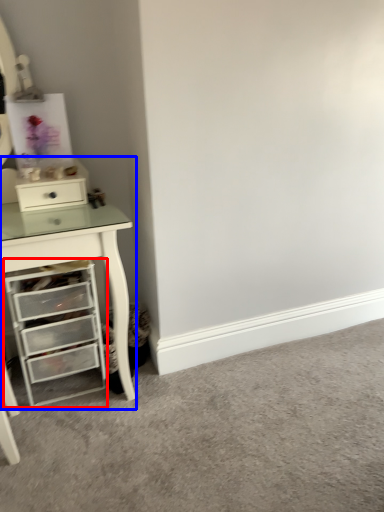
Question: Which point is further to the camera, chest of drawers (highlighted by a red box) or computer desk (highlighted by a blue box)?

Choices:
 (A) chest of drawers
 (B) computer desk

Answer: (A)